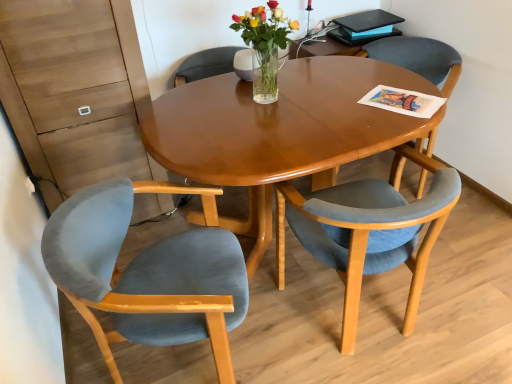
Question: Can you see clear glass vase at center touching matte black magazine at upper right?

Choices:
 (A) yes
 (B) no

Answer: (B)

Question: Is clear glass vase at center wider than matte black magazine at upper right?

Choices:
 (A) no
 (B) yes

Answer: (B)

Question: Can you confirm if clear glass vase at center is bigger than matte black magazine at upper right?

Choices:
 (A) no
 (B) yes

Answer: (B)

Question: Considering the relative sizes of clear glass vase at center and matte black magazine at upper right in the image provided, is clear glass vase at center shorter than matte black magazine at upper right?

Choices:
 (A) no
 (B) yes

Answer: (A)

Question: Can matte black magazine at upper right be found inside clear glass vase at center?

Choices:
 (A) no
 (B) yes

Answer: (A)

Question: Is clear glass vase at center at the right side of matte black magazine at upper right?

Choices:
 (A) yes
 (B) no

Answer: (B)

Question: From a real-world perspective, is matte black magazine at upper right under velvet blue chair at center, which is counted as the first chair, starting from the right?

Choices:
 (A) no
 (B) yes

Answer: (A)

Question: Is matte black magazine at upper right not close to velvet blue chair at center, which is counted as the first chair, starting from the right?

Choices:
 (A) no
 (B) yes

Answer: (A)

Question: Can you confirm if matte black magazine at upper right is thinner than velvet blue chair at center, which is counted as the first chair, starting from the right?

Choices:
 (A) no
 (B) yes

Answer: (B)

Question: Does matte black magazine at upper right appear on the right side of velvet blue chair at center, the 3th chair in the left-to-right sequence?

Choices:
 (A) no
 (B) yes

Answer: (A)

Question: Is matte black magazine at upper right shorter than velvet blue chair at center, the 3th chair in the left-to-right sequence?

Choices:
 (A) yes
 (B) no

Answer: (A)

Question: Does matte black magazine at upper right have a greater width compared to velvet blue chair at center, the 3th chair in the left-to-right sequence?

Choices:
 (A) yes
 (B) no

Answer: (B)

Question: From a real-world perspective, is velvet blue chair at lower right, which appears as the second chair when viewed from the right, physically below matte black magazine at upper right?

Choices:
 (A) yes
 (B) no

Answer: (A)